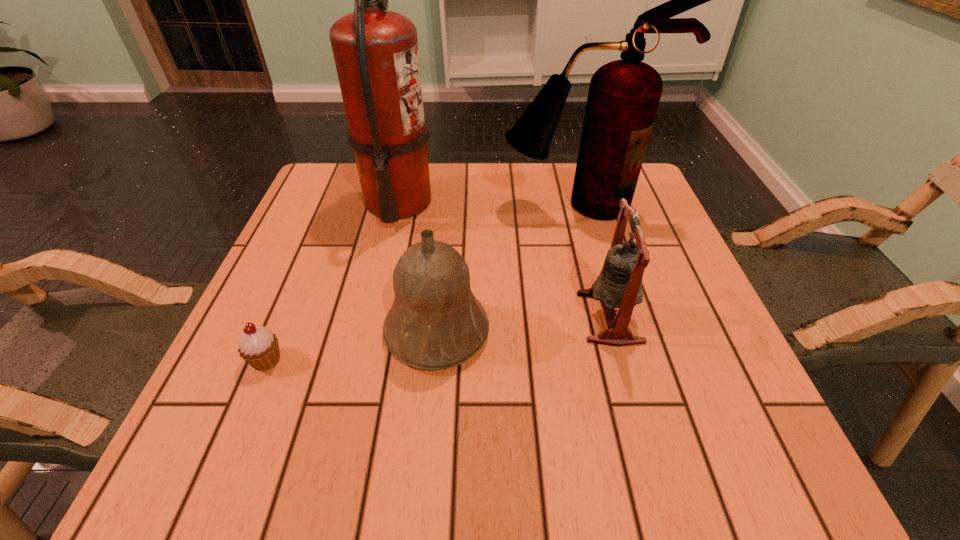
Identify which object is the third nearest to the right fire extinguisher. Please provide its 2D coordinates. Your answer should be formatted as a tuple, i.e. [(x, y)], where the tuple contains the x and y coordinates of a point satisfying the conditions above.

[(435, 322)]

This screenshot has height=540, width=960. I want to click on vacant region that satisfies the following two spatial constraints: 1. toward the nozzle of the left bell; 2. on the right side of the left fire extinguisher, so click(368, 331).

In order to click on free space that satisfies the following two spatial constraints: 1. toward the nozzle of the left fire extinguisher; 2. on the back side of the right bell in this screenshot , I will do `click(372, 317)`.

Where is `vacant space that satisfies the following two spatial constraints: 1. at the nozzle of the right bell; 2. on the left side of the right fire extinguisher`? vacant space that satisfies the following two spatial constraints: 1. at the nozzle of the right bell; 2. on the left side of the right fire extinguisher is located at coordinates (610, 317).

Find the location of a particular element. The image size is (960, 540). blank space that satisfies the following two spatial constraints: 1. toward the nozzle of the left bell; 2. on the right side of the left fire extinguisher is located at coordinates (368, 331).

The height and width of the screenshot is (540, 960). In order to click on vacant area in the image that satisfies the following two spatial constraints: 1. on the back side of the left bell; 2. toward the nozzle of the left fire extinguisher in this screenshot , I will do `click(448, 202)`.

I want to click on blank space that satisfies the following two spatial constraints: 1. toward the nozzle of the left fire extinguisher; 2. on the front side of the cupcake, so click(x=361, y=360).

You are a GUI agent. You are given a task and a screenshot of the screen. Output one action in this format:
    pyautogui.click(x=<x>, y=<y>)
    Task: Click on the free location that satisfies the following two spatial constraints: 1. toward the nozzle of the left fire extinguisher; 2. on the left side of the left bell
    The height and width of the screenshot is (540, 960).
    Given the screenshot: What is the action you would take?
    pyautogui.click(x=368, y=331)

You are a GUI agent. You are given a task and a screenshot of the screen. Output one action in this format:
    pyautogui.click(x=<x>, y=<y>)
    Task: Click on the free spot that satisfies the following two spatial constraints: 1. at the nozzle of the right bell; 2. on the right side of the right fire extinguisher
    The image size is (960, 540).
    Given the screenshot: What is the action you would take?
    pyautogui.click(x=610, y=317)